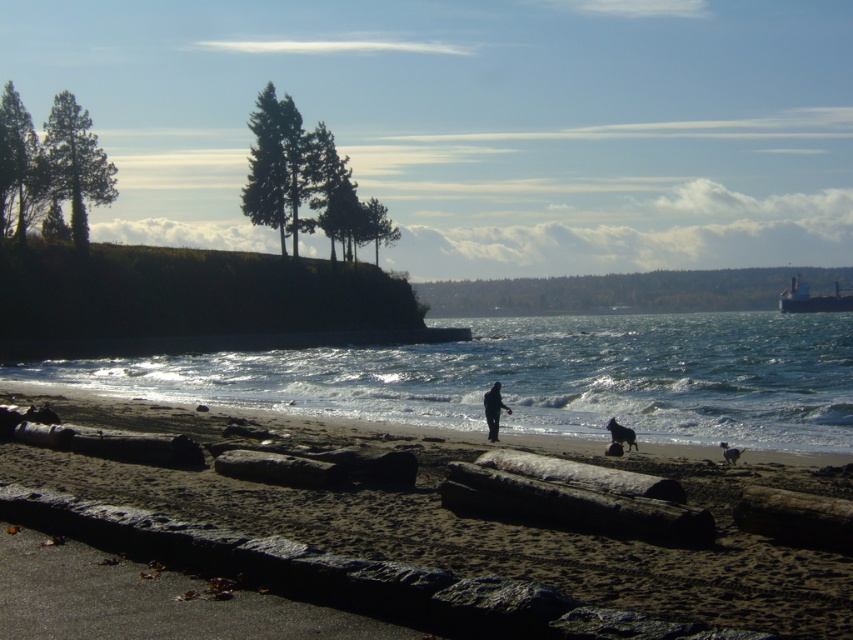
Does clear water at center appear on the left side of black matte jacket at center?

No, clear water at center is not to the left of black matte jacket at center.

Does clear water at center appear on the right side of black matte jacket at center?

Correct, you'll find clear water at center to the right of black matte jacket at center.

What do you see at coordinates (538, 378) in the screenshot? The image size is (853, 640). I see `clear water at center` at bounding box center [538, 378].

The height and width of the screenshot is (640, 853). What are the coordinates of `clear water at center` in the screenshot? It's located at (538, 378).

Which of these two, clear water at center or black matte dog at lower center, stands shorter?

Standing shorter between the two is black matte dog at lower center.

Is clear water at center thinner than black matte dog at lower center?

No.

Between point (376, 371) and point (612, 429), which one is positioned behind?

Positioned behind is point (376, 371).

The height and width of the screenshot is (640, 853). I want to click on clear water at center, so (x=538, y=378).

Describe the element at coordinates (811, 298) in the screenshot. I see `metallic gray ship at upper right` at that location.

Does point (799, 291) come behind point (485, 408)?

Yes, point (799, 291) is behind point (485, 408).

The width and height of the screenshot is (853, 640). What are the coordinates of `metallic gray ship at upper right` in the screenshot? It's located at (811, 298).